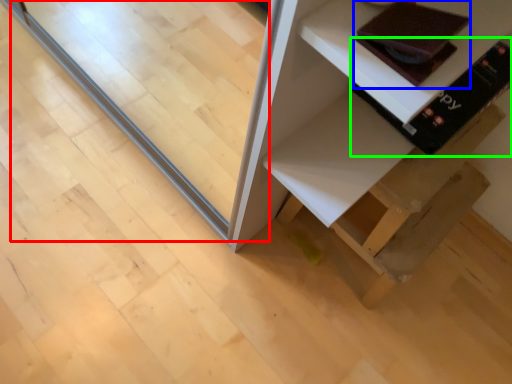
Question: Which is farther away from glass door (highlighted by a red box)? book (highlighted by a blue box) or book (highlighted by a green box)?

Choices:
 (A) book
 (B) book

Answer: (A)